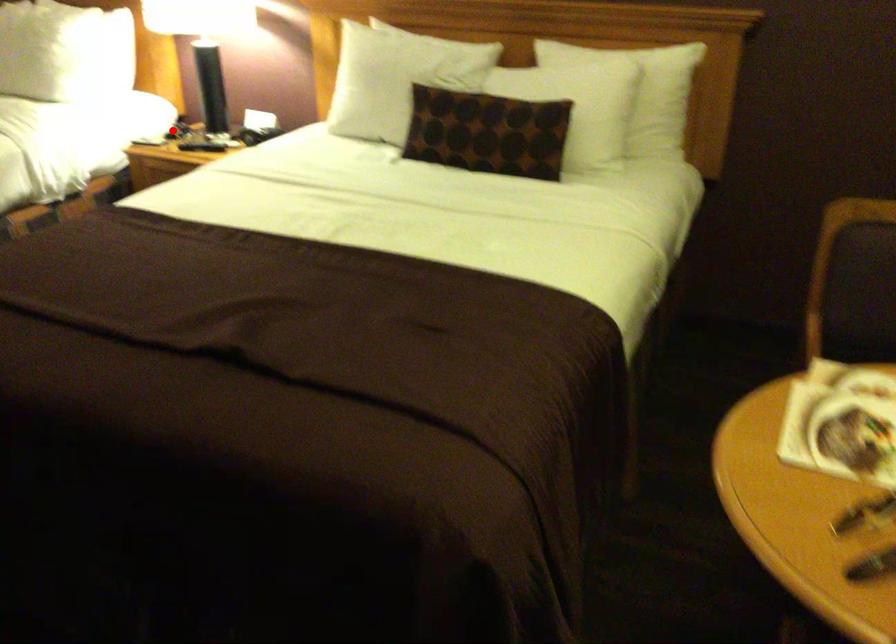
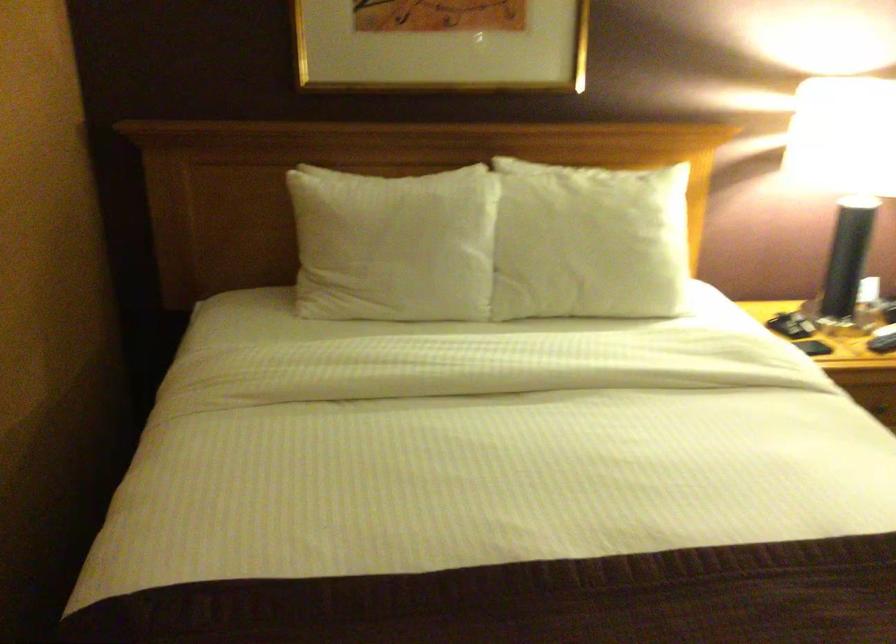
Question: A red point is marked in image1. In image2, is the corresponding 3D point closer to the camera or farther? Reply with the corresponding letter.

Choices:
 (A) The corresponding 3D point is closer.
 (B) The corresponding 3D point is farther.

Answer: (A)